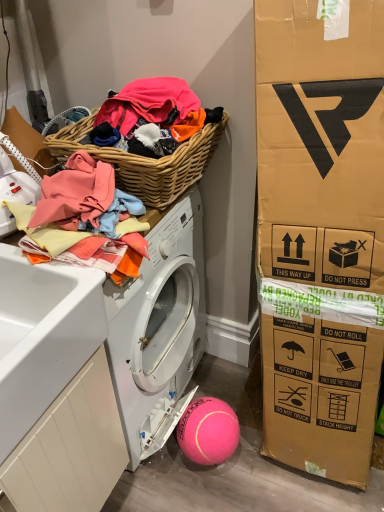
Identify the location of pink rubber ball at lower center. This screenshot has width=384, height=512. (208, 431).

This screenshot has height=512, width=384. Find the location of `white matte washer at left`. white matte washer at left is located at coordinates (15, 186).

What are the coordinates of `white wood drawer at lower left` in the screenshot? It's located at (70, 448).

Image resolution: width=384 pixels, height=512 pixels. In order to click on soft cotton towels at upper left in this screenshot , I will do `click(91, 210)`.

Is soft cotton towels at upper left bigger or smaller than white wood drawer at lower left?

soft cotton towels at upper left is smaller than white wood drawer at lower left.

From the image's perspective, which one is positioned lower, soft cotton towels at upper left or white wood drawer at lower left?

white wood drawer at lower left is shown below in the image.

Which object is positioned more to the right, soft cotton towels at upper left or white wood drawer at lower left?

soft cotton towels at upper left is more to the right.

In order to click on drawer in front of the soft cotton towels at upper left in this screenshot , I will do `click(70, 448)`.

In terms of width, does pink rubber ball at lower center look wider or thinner when compared to white wood drawer at lower left?

pink rubber ball at lower center is thinner than white wood drawer at lower left.

Considering the relative sizes of pink rubber ball at lower center and white wood drawer at lower left in the image provided, is pink rubber ball at lower center shorter than white wood drawer at lower left?

Correct, pink rubber ball at lower center is not as tall as white wood drawer at lower left.

Can you see pink rubber ball at lower center touching white wood drawer at lower left?

They are not placed beside each other.

Does pink rubber ball at lower center have a larger size compared to white wood drawer at lower left?

Actually, pink rubber ball at lower center might be smaller than white wood drawer at lower left.

Is pink rubber ball at lower center facing away from white matte washer at left?

That's not correct — pink rubber ball at lower center is not looking away from white matte washer at left.

Is pink rubber ball at lower center not within white matte washer at left?

Yes, pink rubber ball at lower center is outside of white matte washer at left.

Is pink rubber ball at lower center directly adjacent to white matte washer at left?

No, pink rubber ball at lower center is not making contact with white matte washer at left.

Does pink rubber ball at lower center have a lesser height compared to white matte washer at left?

Yes.

From the image's perspective, between woven wood picnic basket at upper left and pink rubber ball at lower center, which one is located above?

woven wood picnic basket at upper left appears higher in the image.

The width and height of the screenshot is (384, 512). I want to click on ball behind the woven wood picnic basket at upper left, so click(208, 431).

Considering the points (122, 170) and (210, 400), which point is behind, point (122, 170) or point (210, 400)?

Positioned behind is point (210, 400).

Is woven wood picnic basket at upper left next to pink rubber ball at lower center and touching it?

No, woven wood picnic basket at upper left is not in contact with pink rubber ball at lower center.

From the image's perspective, which object appears higher, woven wood picnic basket at upper left or white matte washer at left?

woven wood picnic basket at upper left.

Is there a large distance between woven wood picnic basket at upper left and white matte washer at left?

They are positioned close to each other.

Is point (176, 181) closer or farther from the camera than point (14, 199)?

Point (176, 181) is positioned farther from the camera compared to point (14, 199).

Is soft cotton towels at upper left facing towards pink rubber ball at lower center?

No, soft cotton towels at upper left does not turn towards pink rubber ball at lower center.

I want to click on ball lying below the soft cotton towels at upper left (from the image's perspective), so click(208, 431).

Between soft cotton towels at upper left and pink rubber ball at lower center, which one has less height?

pink rubber ball at lower center is shorter.

Considering the positions of point (68, 178) and point (192, 454), is point (68, 178) closer or farther from the camera than point (192, 454)?

Clearly, point (68, 178) is closer to the camera than point (192, 454).

Locate an element on the screen. This screenshot has width=384, height=512. drawer below the woven wood picnic basket at upper left (from a real-world perspective) is located at coordinates (70, 448).

In terms of height, does woven wood picnic basket at upper left look taller or shorter compared to white wood drawer at lower left?

Clearly, woven wood picnic basket at upper left is shorter compared to white wood drawer at lower left.

Can you tell me how much woven wood picnic basket at upper left and white wood drawer at lower left differ in facing direction?

They differ by 1.56 degrees in their facing directions.

Find the location of a particular element. The width and height of the screenshot is (384, 512). drawer in front of the soft cotton towels at upper left is located at coordinates (70, 448).

Identify the location of ball lying below the white wood drawer at lower left (from the image's perspective). The width and height of the screenshot is (384, 512). (208, 431).

Based on their spatial positions, is white wood drawer at lower left or soft cotton towels at upper left closer to pink rubber ball at lower center?

Based on the image, white wood drawer at lower left appears to be nearer to pink rubber ball at lower center.

Which object lies further to the anchor point white matte washer at left, woven wood picnic basket at upper left or pink rubber ball at lower center?

pink rubber ball at lower center.

When comparing their distances from pink rubber ball at lower center, does soft cotton towels at upper left or woven wood picnic basket at upper left seem closer?

The object closer to pink rubber ball at lower center is soft cotton towels at upper left.

Based on the photo, estimate the real-world distances between objects in this image. Which object is further from pink rubber ball at lower center, white wood drawer at lower left or woven wood picnic basket at upper left?

Among the two, woven wood picnic basket at upper left is located further to pink rubber ball at lower center.

Which object lies nearer to the anchor point pink rubber ball at lower center, woven wood picnic basket at upper left or soft cotton towels at upper left?

soft cotton towels at upper left lies closer to pink rubber ball at lower center than the other object.

Considering their positions, is soft cotton towels at upper left positioned closer to pink rubber ball at lower center than white wood drawer at lower left?

The object closer to pink rubber ball at lower center is white wood drawer at lower left.

Based on their spatial positions, is white wood drawer at lower left or pink rubber ball at lower center closer to white matte washer at left?

white wood drawer at lower left lies closer to white matte washer at left than the other object.

From the image, which object appears to be nearer to woven wood picnic basket at upper left, pink rubber ball at lower center or white wood drawer at lower left?

white wood drawer at lower left.

Where is `washer between woven wood picnic basket at upper left and pink rubber ball at lower center vertically`? This screenshot has width=384, height=512. washer between woven wood picnic basket at upper left and pink rubber ball at lower center vertically is located at coordinates (15, 186).

Locate an element on the screen. clothing between white matte washer at left and white wood drawer at lower left in the vertical direction is located at coordinates (91, 210).

The width and height of the screenshot is (384, 512). I want to click on drawer between white matte washer at left and pink rubber ball at lower center vertically, so click(70, 448).

The width and height of the screenshot is (384, 512). I want to click on drawer that lies between soft cotton towels at upper left and pink rubber ball at lower center from top to bottom, so click(70, 448).